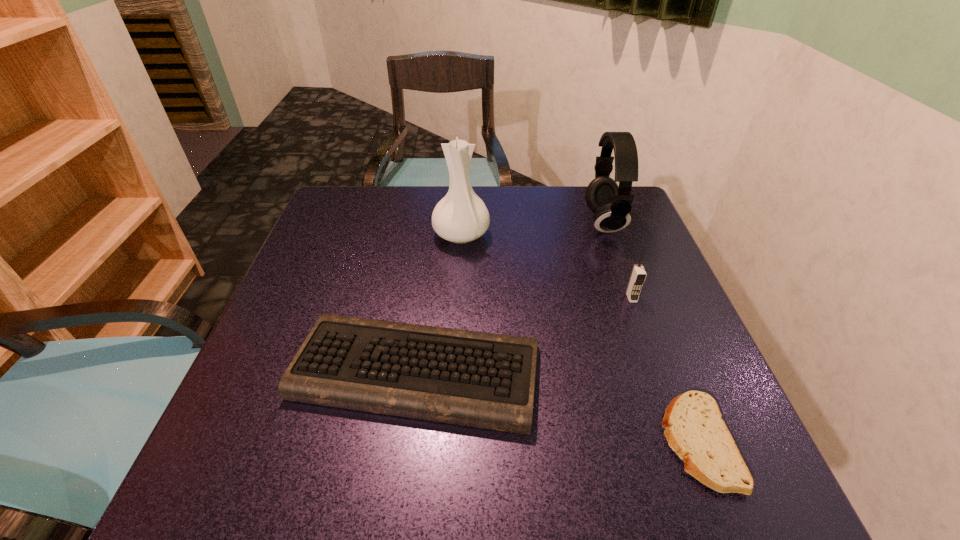
Locate an element on the screen. The image size is (960, 540). vase is located at coordinates (461, 216).

You are a GUI agent. You are given a task and a screenshot of the screen. Output one action in this format:
    pyautogui.click(x=<x>, y=<y>)
    Task: Click on the earphone
    This screenshot has width=960, height=540.
    Given the screenshot: What is the action you would take?
    [x=611, y=204]

Locate an element on the screen. the third nearest object is located at coordinates (638, 275).

You are a GUI agent. You are given a task and a screenshot of the screen. Output one action in this format:
    pyautogui.click(x=<x>, y=<y>)
    Task: Click on the cellular telephone
    
    Given the screenshot: What is the action you would take?
    pyautogui.click(x=638, y=275)

Locate an element on the screen. computer keyboard is located at coordinates point(477,379).

The height and width of the screenshot is (540, 960). What are the coordinates of `the shortest object` in the screenshot? It's located at (695, 431).

This screenshot has height=540, width=960. Identify the location of free space located 0.190m on the right of the vase. (564, 234).

The height and width of the screenshot is (540, 960). What are the coordinates of `vacant region located on the ear cups of the earphone` in the screenshot? It's located at (544, 222).

The width and height of the screenshot is (960, 540). I want to click on vacant area located on the ear cups of the earphone, so click(436, 222).

Where is `blank space located on the ear cups of the earphone`? blank space located on the ear cups of the earphone is located at coordinates (x=507, y=222).